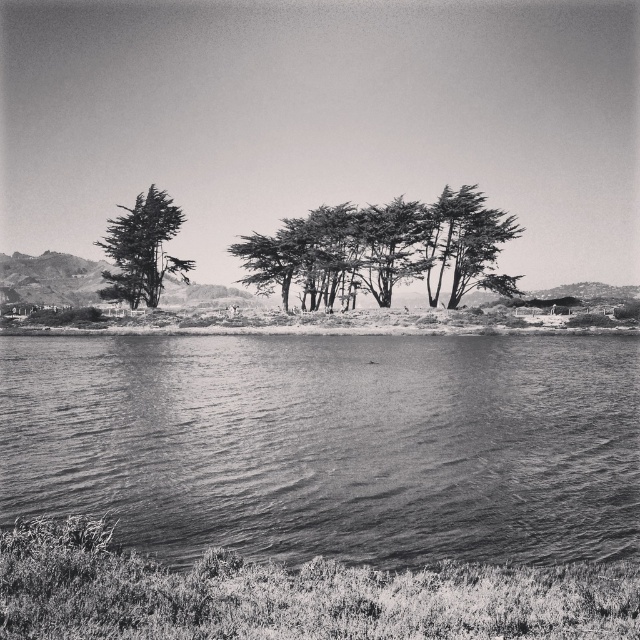
You are a photographer standing in the midground of the scene. You want to take a photo of the smooth bark trees at center and the smooth bark tree at left. Which tree will appear larger in your photo?

The smooth bark trees at center will appear larger in your photo because it is closer to you than the smooth bark tree at left, which is further away.

You are a photographer positioned at the center of the image. You want to capture a shot of the smooth water at lower center. Based on its coordinates, in which direction should you move to frame it properly?

The smooth water at lower center is located at point coordinates, so you should move downward from the center to frame it properly.

You are a hiker who wants to take a photo of the smooth bark trees at center and the smooth bark tree at left. Which tree should you focus on if you want to capture the tallest one in your shot?

The smooth bark tree at left is taller than the smooth bark trees at center, so you should focus on the smooth bark tree at left to capture the tallest one.